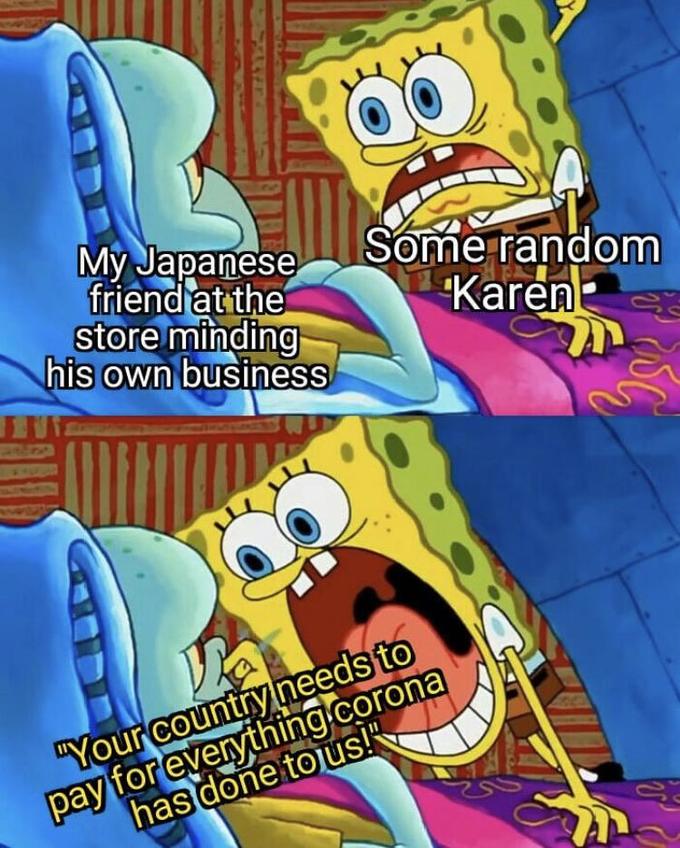
The height and width of the screenshot is (848, 680). Identify the location of pillow. (43, 219).